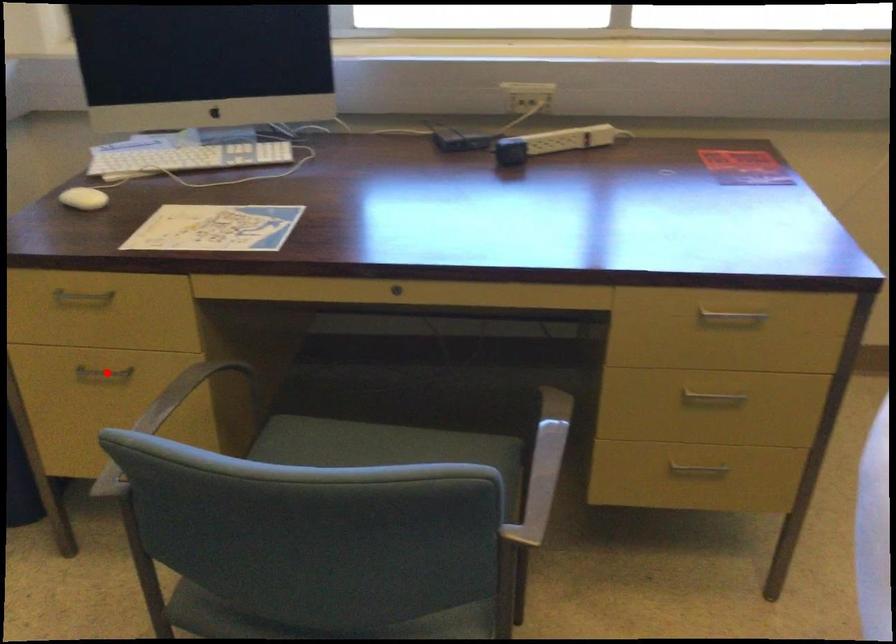
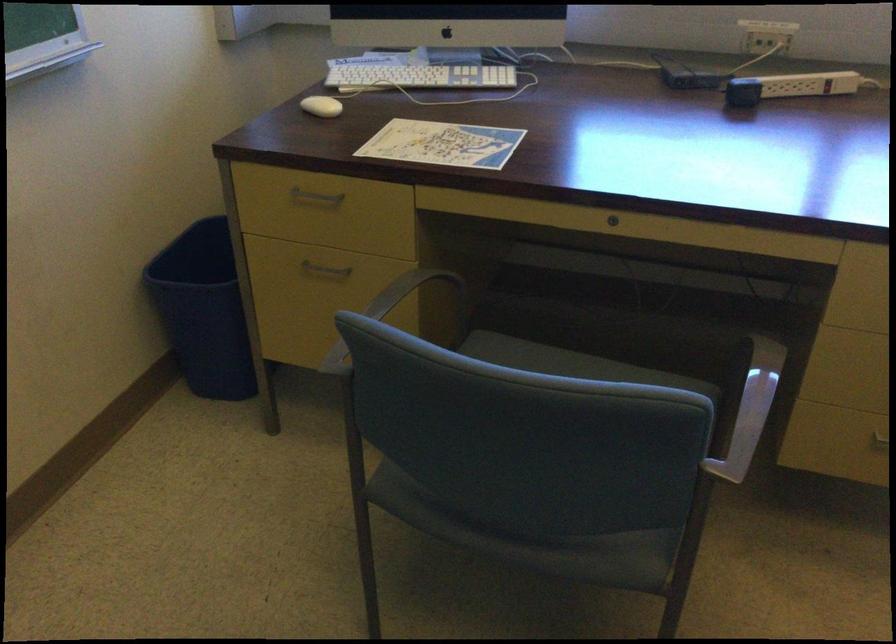
The point at the highlighted location is marked in the first image. Where is the corresponding point in the second image?

(324, 269)